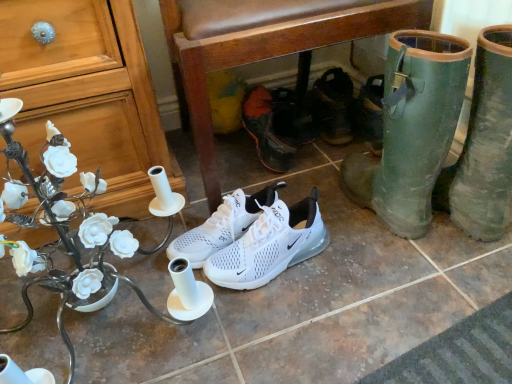
The height and width of the screenshot is (384, 512). Find the location of `vacant area to the right of matte white desk at center`. vacant area to the right of matte white desk at center is located at coordinates (335, 312).